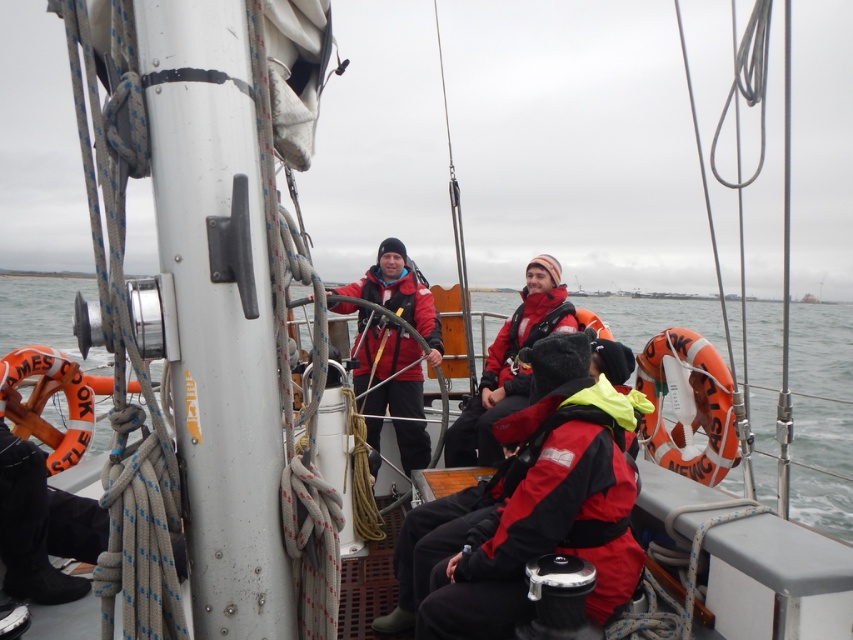
You are standing on the deck of the sailboat and want to reach the point marked at coordinates point (x=718, y=328). If your walking speed is 3 feet per second, how many seconds will it take you to reach that point?

The distance between you and point (x=718, y=328) is 81.70 feet. At a speed of 3 feet per second, it would take approximately 27.23 seconds to reach the point.

You are a safety inspector checking the placement of life jackets on the sailboat. According to the image, which life jacket is positioned lower on the deck between the red matte life jacket at center and the matte orange life jacket at right?

The red matte life jacket at center is positioned lower on the deck compared to the matte orange life jacket at right, as it is located below it.

You are a safety inspector checking the placement of life jackets on the sailboat. According to the image, where is the red matte life jacket at lower center located in relation to the matte orange life jacket at right?

The red matte life jacket at lower center is positioned under the matte orange life jacket at right.